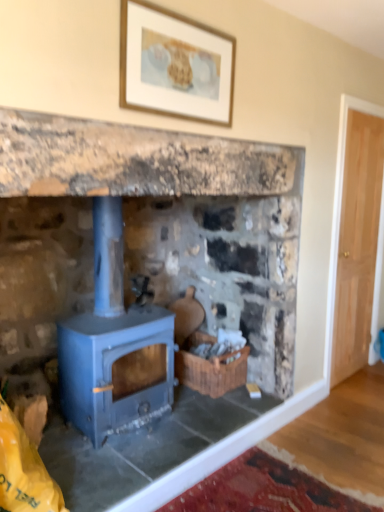
Question: Are blue matte wood burning stove at center and wooden framed artwork at upper center beside each other?

Choices:
 (A) yes
 (B) no

Answer: (B)

Question: Considering the relative positions of blue matte wood burning stove at center and wooden framed artwork at upper center in the image provided, is blue matte wood burning stove at center to the left of wooden framed artwork at upper center from the viewer's perspective?

Choices:
 (A) no
 (B) yes

Answer: (B)

Question: From the image's perspective, is blue matte wood burning stove at center under wooden framed artwork at upper center?

Choices:
 (A) yes
 (B) no

Answer: (A)

Question: Considering the relative positions of blue matte wood burning stove at center and wooden framed artwork at upper center in the image provided, is blue matte wood burning stove at center to the right of wooden framed artwork at upper center from the viewer's perspective?

Choices:
 (A) yes
 (B) no

Answer: (B)

Question: Is blue matte wood burning stove at center turned away from wooden framed artwork at upper center?

Choices:
 (A) no
 (B) yes

Answer: (A)

Question: Is blue matte wood burning stove at center in front of wooden framed artwork at upper center?

Choices:
 (A) no
 (B) yes

Answer: (A)

Question: Is the position of blue matte wood stove at center less distant than that of woven brown basket at center?

Choices:
 (A) no
 (B) yes

Answer: (B)

Question: Is woven brown basket at center at the back of blue matte wood stove at center?

Choices:
 (A) no
 (B) yes

Answer: (A)

Question: Are blue matte wood stove at center and woven brown basket at center beside each other?

Choices:
 (A) no
 (B) yes

Answer: (A)

Question: From the image's perspective, would you say blue matte wood stove at center is positioned over woven brown basket at center?

Choices:
 (A) no
 (B) yes

Answer: (B)

Question: Considering the relative sizes of blue matte wood stove at center and woven brown basket at center in the image provided, is blue matte wood stove at center wider than woven brown basket at center?

Choices:
 (A) yes
 (B) no

Answer: (A)

Question: Is blue matte wood stove at center shorter than woven brown basket at center?

Choices:
 (A) no
 (B) yes

Answer: (A)

Question: Is woven brown basket at center placed right next to blue matte wood burning stove at center?

Choices:
 (A) no
 (B) yes

Answer: (A)